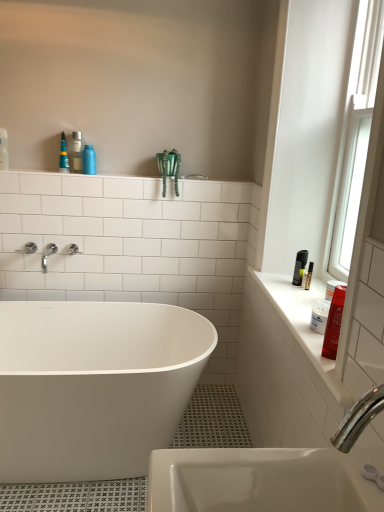
The image size is (384, 512). What do you see at coordinates (334, 323) in the screenshot?
I see `shiny red plastic bottle at right, positioned as the second toiletry in left-to-right order` at bounding box center [334, 323].

This screenshot has height=512, width=384. I want to click on blue plastic bottle at upper center, the first toiletry in the top-to-bottom sequence, so click(89, 160).

Describe the element at coordinates (48, 255) in the screenshot. This screenshot has height=512, width=384. I see `silver metallic faucet at upper left` at that location.

The width and height of the screenshot is (384, 512). Identify the location of white glossy counter top at right. (303, 332).

Considering the sizes of objects silver metallic faucet at upper left and white glossy counter top at right in the image provided, who is thinner, silver metallic faucet at upper left or white glossy counter top at right?

Thinner between the two is silver metallic faucet at upper left.

Is silver metallic faucet at upper left positioned beyond the bounds of white glossy counter top at right?

Yes, silver metallic faucet at upper left is located beyond the bounds of white glossy counter top at right.

From the image's perspective, is silver metallic faucet at upper left on top of white glossy counter top at right?

Yes, from the image's perspective, silver metallic faucet at upper left is over white glossy counter top at right.

Is silver metallic faucet at upper left directly adjacent to white glossy counter top at right?

silver metallic faucet at upper left and white glossy counter top at right are clearly separated.

From a real-world perspective, is white glossy bathtub at center physically located above or below shiny red plastic bottle at right, which is counted as the first toiletry, starting from the right?

In terms of real-world spatial position, white glossy bathtub at center is below shiny red plastic bottle at right, which is counted as the first toiletry, starting from the right.

Consider the image. Is white glossy bathtub at center at the right side of shiny red plastic bottle at right, the 1th toiletry from the bottom?

In fact, white glossy bathtub at center is to the left of shiny red plastic bottle at right, the 1th toiletry from the bottom.

Does white glossy bathtub at center turn towards shiny red plastic bottle at right, the 1th toiletry from the bottom?

No.

Is the depth of white glossy bathtub at center greater than that of shiny red plastic bottle at right, the first toiletry in the front-to-back sequence?

Yes, white glossy bathtub at center is further from the viewer.

From the picture: What's the angular difference between white glossy bathtub at center and blue plastic bottle at upper center, the second toiletry positioned from the bottom,'s facing directions?

0.916 degrees separate the facing orientations of white glossy bathtub at center and blue plastic bottle at upper center, the second toiletry positioned from the bottom.

Does white glossy bathtub at center have a larger size compared to blue plastic bottle at upper center, the first toiletry in the top-to-bottom sequence?

Indeed, white glossy bathtub at center has a larger size compared to blue plastic bottle at upper center, the first toiletry in the top-to-bottom sequence.

Considering the positions of objects white glossy bathtub at center and blue plastic bottle at upper center, acting as the 2th toiletry starting from the front, in the image provided, who is in front, white glossy bathtub at center or blue plastic bottle at upper center, acting as the 2th toiletry starting from the front,?

white glossy bathtub at center is in front.

In the scene shown: Considering the sizes of objects white glossy bathtub at center and blue plastic bottle at upper center, positioned as the 1th toiletry in back-to-front order, in the image provided, who is shorter, white glossy bathtub at center or blue plastic bottle at upper center, positioned as the 1th toiletry in back-to-front order,?

Standing shorter between the two is blue plastic bottle at upper center, positioned as the 1th toiletry in back-to-front order.

From a real-world perspective, who is located lower, white glossy counter top at right or silver metallic faucet at upper left?

white glossy counter top at right.

Find the location of `tap behind the white glossy counter top at right`. tap behind the white glossy counter top at right is located at coordinates (48, 255).

How different are the orientations of white glossy counter top at right and silver metallic faucet at upper left in degrees?

88.9 degrees.

Is white glossy counter top at right spatially inside silver metallic faucet at upper left, or outside of it?

white glossy counter top at right exists outside the volume of silver metallic faucet at upper left.

Can you confirm if silver metallic faucet at upper left is positioned to the right of white glossy bathtub at center?

No.

Which is closer to the camera, [45,262] or [30,424]?

Point [45,262] is farther from the camera than point [30,424].

Can you tell me how much silver metallic faucet at upper left and white glossy bathtub at center differ in facing direction?

They differ by 0.916 degrees in their facing directions.

Considering the relative positions of silver metallic faucet at upper left and white glass window at right in the image provided, is silver metallic faucet at upper left to the left or to the right of white glass window at right?

Based on their positions, silver metallic faucet at upper left is located to the left of white glass window at right.

Is silver metallic faucet at upper left inside or outside of white glass window at right?

silver metallic faucet at upper left is spatially situated outside white glass window at right.

Which of these two, silver metallic faucet at upper left or white glass window at right, is wider?

silver metallic faucet at upper left.

Between point (87, 145) and point (264, 281), which one is positioned in front?

Point (264, 281)

Who is shorter, blue plastic bottle at upper center, the first toiletry in the top-to-bottom sequence, or white glossy counter top at right?

Standing shorter between the two is white glossy counter top at right.

Can you tell me how much blue plastic bottle at upper center, the second toiletry positioned from the right, and white glossy counter top at right differ in facing direction?

88.9 degrees separate the facing orientations of blue plastic bottle at upper center, the second toiletry positioned from the right, and white glossy counter top at right.

Is blue plastic bottle at upper center, acting as the 2th toiletry starting from the front, far from white glossy counter top at right?

blue plastic bottle at upper center, acting as the 2th toiletry starting from the front, is far away from white glossy counter top at right.

Locate an element on the screen. This screenshot has width=384, height=512. tap behind the white glossy counter top at right is located at coordinates (48, 255).

At what (x,y) coordinates should I click in order to perform the action: click on bathtub located on the left of shiny red plastic bottle at right, which appears as the second toiletry when viewed from the top. Please return your answer as a coordinate pair (x, y). Image resolution: width=384 pixels, height=512 pixels. Looking at the image, I should click on (94, 386).

Looking at the image, which one is located closer to shiny red plastic bottle at right, the 1th toiletry from the bottom, white glossy counter top at right or white glossy bathtub at center?

Based on the image, white glossy counter top at right appears to be nearer to shiny red plastic bottle at right, the 1th toiletry from the bottom.

Based on their spatial positions, is white glossy counter top at right or silver metallic faucet at upper left closer to shiny red plastic bottle at right, which is counted as the first toiletry, starting from the right?

white glossy counter top at right lies closer to shiny red plastic bottle at right, which is counted as the first toiletry, starting from the right, than the other object.

Estimate the real-world distances between objects in this image. Which object is further from white glass window at right, white glossy bathtub at center or shiny red plastic bottle at right, the 2th toiletry in the back-to-front sequence?

The object further to white glass window at right is white glossy bathtub at center.

From the image, which object appears to be farther from blue plastic bottle at upper center, the second toiletry positioned from the bottom, shiny red plastic bottle at right, the first toiletry in the front-to-back sequence, or white glossy counter top at right?

Answer: shiny red plastic bottle at right, the first toiletry in the front-to-back sequence, is positioned further to the anchor blue plastic bottle at upper center, the second toiletry positioned from the bottom.

Based on their spatial positions, is shiny red plastic bottle at right, the 2th toiletry in the back-to-front sequence, or white glossy bathtub at center closer to white glossy counter top at right?

shiny red plastic bottle at right, the 2th toiletry in the back-to-front sequence, is positioned closer to the anchor white glossy counter top at right.

Looking at the image, which one is located closer to silver metallic faucet at upper left, white glossy counter top at right or white glossy bathtub at center?

Based on the image, white glossy bathtub at center appears to be nearer to silver metallic faucet at upper left.

Considering their positions, is shiny red plastic bottle at right, the 2th toiletry in the back-to-front sequence, positioned further to blue plastic bottle at upper center, the first toiletry in the top-to-bottom sequence, than white glossy bathtub at center?

Based on the image, shiny red plastic bottle at right, the 2th toiletry in the back-to-front sequence, appears to be further to blue plastic bottle at upper center, the first toiletry in the top-to-bottom sequence.

When comparing their distances from white glossy counter top at right, does shiny red plastic bottle at right, the 1th toiletry from the bottom, or white glass window at right seem further?

white glass window at right is positioned further to the anchor white glossy counter top at right.

Find the location of a particular element. This screenshot has height=512, width=384. toiletry between silver metallic faucet at upper left and shiny red plastic bottle at right, which is counted as the first toiletry, starting from the right, in the horizontal direction is located at coordinates (89, 160).

The width and height of the screenshot is (384, 512). Identify the location of bathtub located between silver metallic faucet at upper left and white glass window at right in the left-right direction. (94, 386).

I want to click on toiletry between white glossy bathtub at center and white glossy counter top at right from left to right, so click(334, 323).

This screenshot has height=512, width=384. I want to click on bathtub situated between blue plastic bottle at upper center, which is the first toiletry in left-to-right order, and white glass window at right from left to right, so click(x=94, y=386).